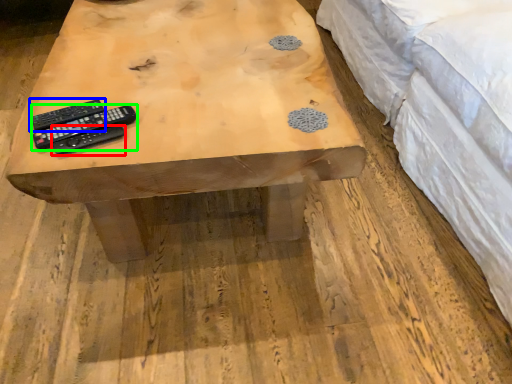
Question: Which object is positioned closest to remote control (highlighted by a red box)? Select from remote control (highlighted by a blue box) and remote control (highlighted by a green box).

Choices:
 (A) remote control
 (B) remote control

Answer: (B)